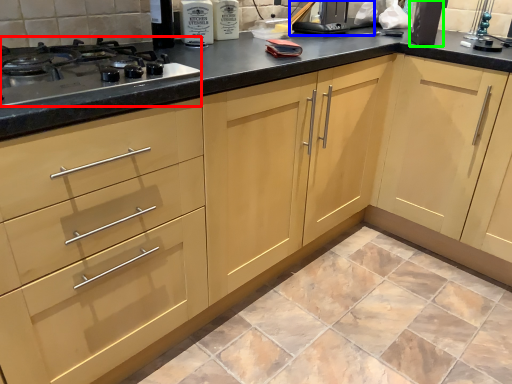
Question: Estimate the real-world distances between objects in this image. Which object is closer to gas stove (highlighted by a red box), appliance (highlighted by a blue box) or appliance (highlighted by a green box)?

Choices:
 (A) appliance
 (B) appliance

Answer: (A)